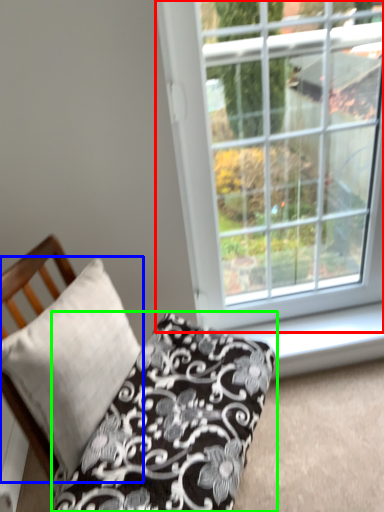
Question: Considering the real-world distances, which object is farthest from window (highlighted by a red box)? pillow (highlighted by a blue box) or pillow (highlighted by a green box)?

Choices:
 (A) pillow
 (B) pillow

Answer: (A)